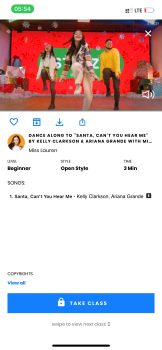
The height and width of the screenshot is (350, 162). Find the location of `stack of presents`. stack of presents is located at coordinates (146, 76).